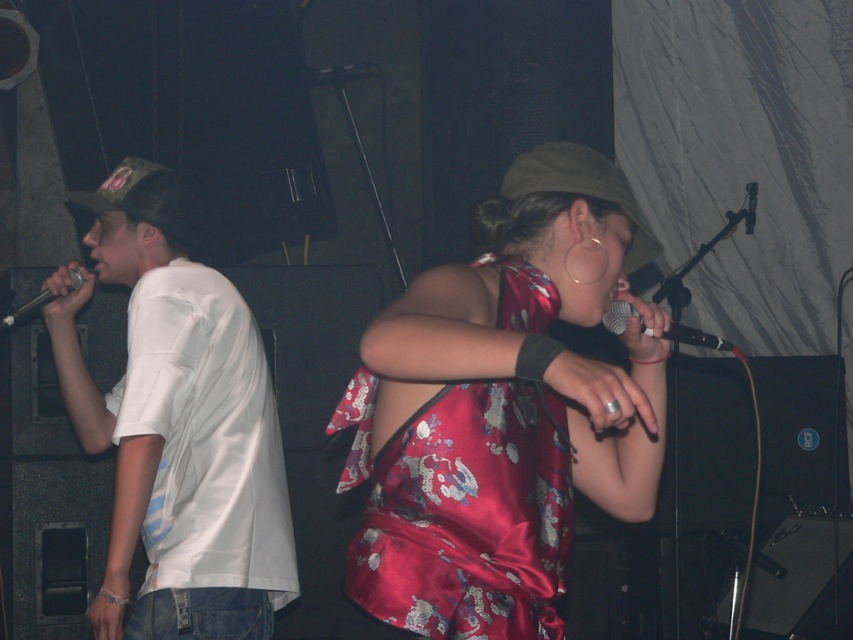
Question: Which is farther from the white satin shirt at left?

Choices:
 (A) satin dress at center
 (B) black matte microphone at center

Answer: (B)

Question: Is black matte microphone at center wider than matte black microphone at left?

Choices:
 (A) yes
 (B) no

Answer: (B)

Question: Which point is closer to the camera?

Choices:
 (A) (26, 308)
 (B) (256, 483)
 (C) (502, 419)
 (D) (706, 336)

Answer: (C)

Question: Does black matte microphone at center lie in front of matte black microphone at left?

Choices:
 (A) no
 (B) yes

Answer: (B)

Question: Is white satin shirt at left wider than matte black microphone at left?

Choices:
 (A) no
 (B) yes

Answer: (B)

Question: Which object appears farthest from the camera in this image?

Choices:
 (A) white satin shirt at left
 (B) matte black microphone at left
 (C) satin dress at center
 (D) black matte microphone at center

Answer: (B)